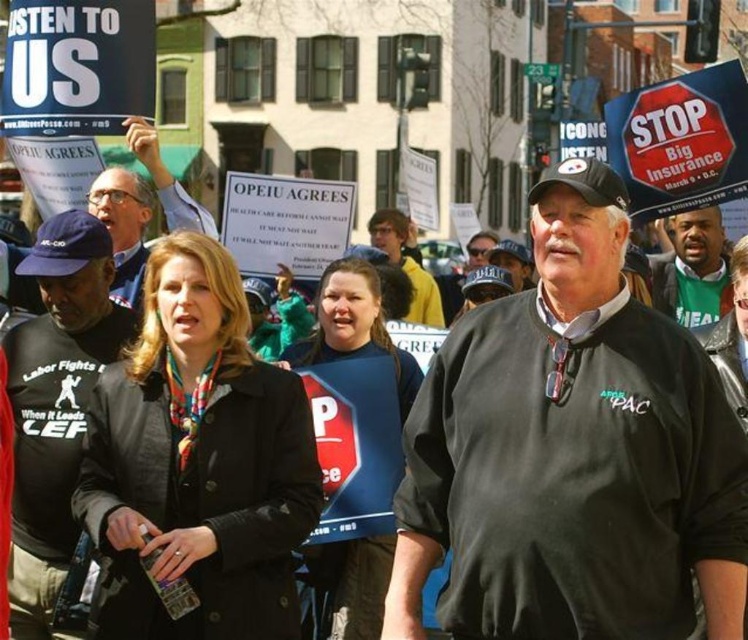
Question: Is black matte jacket at center smaller than black jacket at center?

Choices:
 (A) no
 (B) yes

Answer: (B)

Question: Does black matte jacket at center have a greater width compared to green fabric shirt at right?

Choices:
 (A) yes
 (B) no

Answer: (A)

Question: Estimate the real-world distances between objects in this image. Which object is farther from the green fabric shirt at right?

Choices:
 (A) black jacket at center
 (B) black fabric shirt at left

Answer: (B)

Question: Which object is positioned closest to the green fabric shirt at right?

Choices:
 (A) black fabric shirt at left
 (B) black matte jacket at center
 (C) black jacket at center

Answer: (B)

Question: From the image, what is the correct spatial relationship of black matte jacket at center in relation to black fabric shirt at left?

Choices:
 (A) right
 (B) left

Answer: (A)

Question: Which object is the farthest from the black jacket at center?

Choices:
 (A) black fabric shirt at left
 (B) black matte jacket at center
 (C) green fabric shirt at right

Answer: (C)